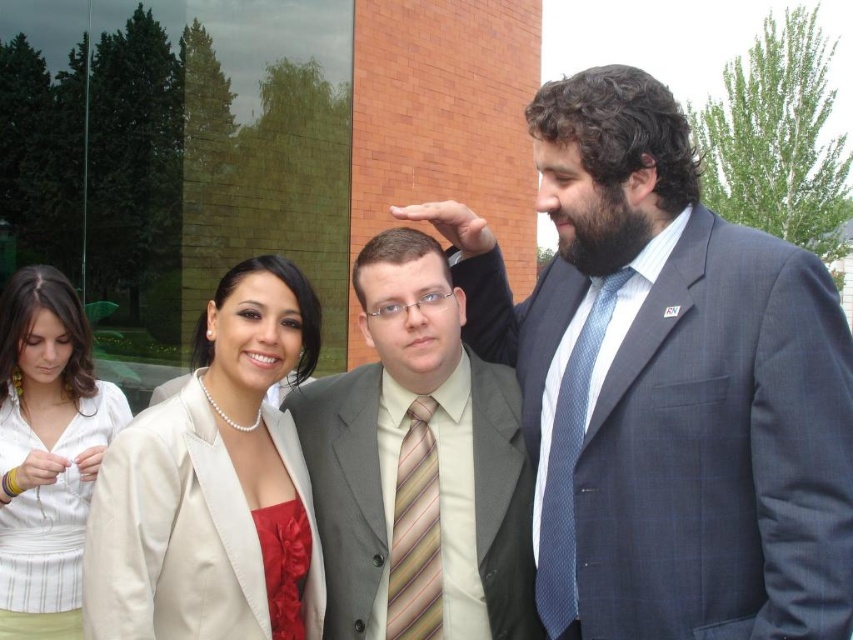
Between striped tie at center and white striped shirt at left, which one is positioned lower?

white striped shirt at left is lower down.

What do you see at coordinates (419, 456) in the screenshot? I see `striped tie at center` at bounding box center [419, 456].

This screenshot has width=853, height=640. What are the coordinates of `striped tie at center` in the screenshot? It's located at (419, 456).

Where is `striped tie at center`? The image size is (853, 640). striped tie at center is located at coordinates tap(419, 456).

Does white striped shirt at left have a lesser height compared to silky satin dress at center?

Incorrect, white striped shirt at left's height does not fall short of silky satin dress at center's.

Does white striped shirt at left have a lesser width compared to silky satin dress at center?

In fact, white striped shirt at left might be wider than silky satin dress at center.

Does point (16, 288) come farther from viewer compared to point (271, 545)?

Yes.

Where is `white striped shirt at left`? white striped shirt at left is located at coordinates (47, 451).

Which is more to the left, matte white blazer at center or blue textured tie at center?

matte white blazer at center is more to the left.

This screenshot has width=853, height=640. What do you see at coordinates (213, 484) in the screenshot?
I see `matte white blazer at center` at bounding box center [213, 484].

Measure the distance between matte white blazer at center and camera.

matte white blazer at center and camera are 2.76 meters apart from each other.

Find the location of a particular element. matte white blazer at center is located at coordinates (213, 484).